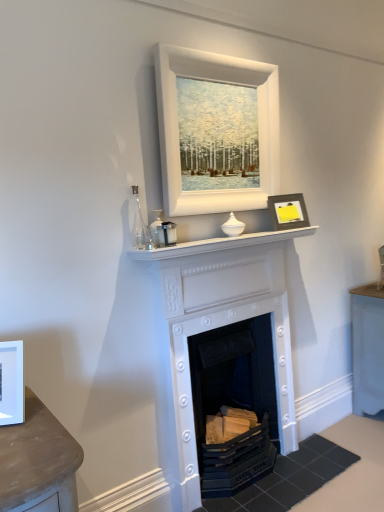
The height and width of the screenshot is (512, 384). What are the coordinates of `matte black frame at upper right, which ranks as the 3th picture frame in left-to-right order` in the screenshot? It's located at (288, 211).

Measure the distance between matte black frame at upper right, placed as the 1th picture frame when sorted from right to left, and camera.

matte black frame at upper right, placed as the 1th picture frame when sorted from right to left, is 7.21 feet away from camera.

Where is `white glossy mantle at center`? white glossy mantle at center is located at coordinates (215, 245).

What is the approximate height of white matte picture frame at left, which ranks as the 1th picture frame in left-to-right order?

It is 9.43 inches.

This screenshot has height=512, width=384. Describe the element at coordinates (235, 403) in the screenshot. I see `white painted wood fireplace at center, arranged as the 2th fireplace when viewed from the top` at that location.

Identify the location of white painted wood fireplace at center, placed as the 1th fireplace when sorted from bottom to top. (235, 403).

Locate an element on the screen. matte black frame at upper right, the 2th picture frame positioned from the top is located at coordinates (288, 211).

This screenshot has width=384, height=512. In the image, there is a matte black frame at upper right, which is the 3th picture frame in front-to-back order. Identify the location of picture frame above it (from the image's perspective). (178, 130).

Based on the photo, between white matte picture frame at upper center, marked as the 3th picture frame in a bottom-to-top arrangement, and matte black frame at upper right, which ranks as the 3th picture frame in left-to-right order, which one has smaller width?

matte black frame at upper right, which ranks as the 3th picture frame in left-to-right order.

In the scene shown: Is white matte picture frame at upper center, which appears as the 2th picture frame when viewed from the right, positioned before matte black frame at upper right, placed as the 1th picture frame when sorted from right to left?

Yes, it is.

Is white matte picture frame at upper center, which appears as the 2th picture frame when viewed from the right, completely or partially outside of matte black frame at upper right, the 2th picture frame positioned from the top?

Absolutely, white matte picture frame at upper center, which appears as the 2th picture frame when viewed from the right, is external to matte black frame at upper right, the 2th picture frame positioned from the top.

Does matte black frame at upper right, arranged as the second picture frame when ordered from the bottom, turn towards white painted wood fireplace at center, arranged as the 2th fireplace when viewed from the top?

No, matte black frame at upper right, arranged as the second picture frame when ordered from the bottom, does not turn towards white painted wood fireplace at center, arranged as the 2th fireplace when viewed from the top.

From the image's perspective, between matte black frame at upper right, placed as the 1th picture frame when sorted from right to left, and white painted wood fireplace at center, arranged as the 2th fireplace when viewed from the top, who is located below?

white painted wood fireplace at center, arranged as the 2th fireplace when viewed from the top, from the image's perspective.

Is matte black frame at upper right, the first picture frame positioned from the back, bigger or smaller than white painted wood fireplace at center, placed as the 1th fireplace when sorted from bottom to top?

matte black frame at upper right, the first picture frame positioned from the back, is smaller than white painted wood fireplace at center, placed as the 1th fireplace when sorted from bottom to top.

Does matte black frame at upper right, which is the 3th picture frame in front-to-back order, come behind white painted wood fireplace at center, arranged as the 2th fireplace when viewed from the top?

Yes, the depth of matte black frame at upper right, which is the 3th picture frame in front-to-back order, is greater than that of white painted wood fireplace at center, arranged as the 2th fireplace when viewed from the top.

Locate an element on the screen. This screenshot has width=384, height=512. fireplace that is the 2nd object located in front of the matte black frame at upper right, which ranks as the 3th picture frame in left-to-right order is located at coordinates (221, 325).

Is point (184, 472) in front of point (287, 220)?

Yes, point (184, 472) is in front of point (287, 220).

Is white painted fireplace at center, which is the first fireplace in top-to-bottom order, looking in the opposite direction of matte black frame at upper right, placed as the 1th picture frame when sorted from right to left?

white painted fireplace at center, which is the first fireplace in top-to-bottom order, does not have its back to matte black frame at upper right, placed as the 1th picture frame when sorted from right to left.

Between white glossy mantle at center and matte black frame at upper right, arranged as the second picture frame when ordered from the bottom, which one has more height?

matte black frame at upper right, arranged as the second picture frame when ordered from the bottom.

In terms of size, does white glossy mantle at center appear bigger or smaller than matte black frame at upper right, the 2th picture frame positioned from the top?

Considering their sizes, white glossy mantle at center takes up more space than matte black frame at upper right, the 2th picture frame positioned from the top.

Considering the positions of points (205, 240) and (292, 199), is point (205, 240) closer to camera compared to point (292, 199)?

Yes, point (205, 240) is in front of point (292, 199).

From a real-world perspective, does white glossy mantle at center sit lower than matte black frame at upper right, the 2th picture frame positioned from the top?

Yes, from a real-world perspective, white glossy mantle at center is under matte black frame at upper right, the 2th picture frame positioned from the top.

Is white matte picture frame at upper center, the 2th picture frame viewed from the back, far away from white painted wood fireplace at center, arranged as the 2th fireplace when viewed from the top?

white matte picture frame at upper center, the 2th picture frame viewed from the back, is far away from white painted wood fireplace at center, arranged as the 2th fireplace when viewed from the top.

From the picture: Considering the relative sizes of white matte picture frame at upper center, the 2th picture frame viewed from the back, and white painted wood fireplace at center, placed as the 1th fireplace when sorted from bottom to top, in the image provided, is white matte picture frame at upper center, the 2th picture frame viewed from the back, taller than white painted wood fireplace at center, placed as the 1th fireplace when sorted from bottom to top,?

No, white matte picture frame at upper center, the 2th picture frame viewed from the back, is not taller than white painted wood fireplace at center, placed as the 1th fireplace when sorted from bottom to top.

Does white matte picture frame at upper center, the 2th picture frame viewed from the back, turn towards white painted wood fireplace at center, arranged as the 2th fireplace when viewed from the top?

No.

Measure the distance from white painted fireplace at center, which is the first fireplace in top-to-bottom order, to white glossy mantle at center.

white painted fireplace at center, which is the first fireplace in top-to-bottom order, and white glossy mantle at center are 11.15 inches apart.

Are white painted fireplace at center, placed as the 2th fireplace when sorted from bottom to top, and white glossy mantle at center far apart?

That's not correct — white painted fireplace at center, placed as the 2th fireplace when sorted from bottom to top, is a little close to white glossy mantle at center.

Is point (201, 315) positioned behind point (156, 259)?

Yes, point (201, 315) is behind point (156, 259).

In the scene shown: Looking at their sizes, would you say white painted fireplace at center, which is the first fireplace in top-to-bottom order, is wider or thinner than white glossy mantle at center?

Considering their sizes, white painted fireplace at center, which is the first fireplace in top-to-bottom order, looks broader than white glossy mantle at center.

In terms of size, does white glossy mantle at center appear bigger or smaller than white matte picture frame at upper center, the 2th picture frame viewed from the back?

In the image, white glossy mantle at center appears to be smaller than white matte picture frame at upper center, the 2th picture frame viewed from the back.

Is white glossy mantle at center at the right side of white matte picture frame at upper center, marked as the 3th picture frame in a bottom-to-top arrangement?

Indeed, white glossy mantle at center is positioned on the right side of white matte picture frame at upper center, marked as the 3th picture frame in a bottom-to-top arrangement.

Which of these two, white glossy mantle at center or white matte picture frame at upper center, marked as the 3th picture frame in a bottom-to-top arrangement, is thinner?

white matte picture frame at upper center, marked as the 3th picture frame in a bottom-to-top arrangement, is thinner.

Which picture frame is the 1st one when counting from the front of the matte black frame at upper right, which ranks as the 3th picture frame in left-to-right order? Please provide its 2D coordinates.

[(178, 130)]

From the image's perspective, which picture frame is the 2nd one above the white painted wood fireplace at center, placed as the 1th fireplace when sorted from bottom to top? Please provide its 2D coordinates.

[(288, 211)]

Considering their positions, is white glossy mantle at center positioned further to white matte picture frame at upper center, marked as the 3th picture frame in a bottom-to-top arrangement, than matte black frame at upper right, arranged as the second picture frame when ordered from the bottom?

Among the two, white glossy mantle at center is located further to white matte picture frame at upper center, marked as the 3th picture frame in a bottom-to-top arrangement.

Considering their positions, is matte black frame at upper right, arranged as the second picture frame when ordered from the bottom, positioned closer to white painted wood fireplace at center, arranged as the 2th fireplace when viewed from the top, than white matte picture frame at left, which ranks as the 1th picture frame in left-to-right order?

matte black frame at upper right, arranged as the second picture frame when ordered from the bottom, lies closer to white painted wood fireplace at center, arranged as the 2th fireplace when viewed from the top, than the other object.

From the picture: When comparing their distances from white matte picture frame at left, which is the third picture frame in top-to-bottom order, does matte black frame at upper right, which is the 3th picture frame in front-to-back order, or white glossy mantle at center seem closer?

white glossy mantle at center is positioned closer to the anchor white matte picture frame at left, which is the third picture frame in top-to-bottom order.

Estimate the real-world distances between objects in this image. Which object is further from white matte picture frame at left, the third picture frame positioned from the back, white painted fireplace at center, placed as the 2th fireplace when sorted from bottom to top, or matte black frame at upper right, arranged as the second picture frame when ordered from the bottom?

Among the two, matte black frame at upper right, arranged as the second picture frame when ordered from the bottom, is located further to white matte picture frame at left, the third picture frame positioned from the back.

Based on their spatial positions, is white painted fireplace at center, placed as the 2th fireplace when sorted from bottom to top, or white matte picture frame at left, placed as the first picture frame when sorted from front to back, further from white matte picture frame at upper center, which is the 1th picture frame in top-to-bottom order?

white matte picture frame at left, placed as the first picture frame when sorted from front to back, lies further to white matte picture frame at upper center, which is the 1th picture frame in top-to-bottom order, than the other object.

Looking at this image, estimate the real-world distances between objects in this image. Which object is closer to white painted wood fireplace at center, placed as the 1th fireplace when sorted from bottom to top, white matte picture frame at upper center, marked as the second picture frame in a left-to-right arrangement, or white painted fireplace at center, which is the first fireplace in top-to-bottom order?

white painted fireplace at center, which is the first fireplace in top-to-bottom order, is closer to white painted wood fireplace at center, placed as the 1th fireplace when sorted from bottom to top.

From the image, which object appears to be nearer to white matte picture frame at upper center, which appears as the 2th picture frame when viewed from the right, white painted wood fireplace at center, placed as the 1th fireplace when sorted from bottom to top, or matte black frame at upper right, the first picture frame positioned from the back?

matte black frame at upper right, the first picture frame positioned from the back, lies closer to white matte picture frame at upper center, which appears as the 2th picture frame when viewed from the right, than the other object.

Considering their positions, is white painted wood fireplace at center, placed as the 1th fireplace when sorted from bottom to top, positioned closer to white glossy mantle at center than white painted fireplace at center, which is the first fireplace in top-to-bottom order?

white painted fireplace at center, which is the first fireplace in top-to-bottom order.

Locate an element on the screen. mantle between white matte picture frame at upper center, which is the 1th picture frame in top-to-bottom order, and white painted wood fireplace at center, arranged as the 2th fireplace when viewed from the top, in the vertical direction is located at coordinates (215, 245).

Find the location of `fireplace between matte black frame at upper right, arranged as the second picture frame when ordered from the bottom, and white painted wood fireplace at center, placed as the 1th fireplace when sorted from bottom to top, from top to bottom`. fireplace between matte black frame at upper right, arranged as the second picture frame when ordered from the bottom, and white painted wood fireplace at center, placed as the 1th fireplace when sorted from bottom to top, from top to bottom is located at coordinates (221, 325).

This screenshot has width=384, height=512. I want to click on mantle between matte black frame at upper right, arranged as the second picture frame when ordered from the bottom, and white painted wood fireplace at center, arranged as the 2th fireplace when viewed from the top, from top to bottom, so click(215, 245).

Image resolution: width=384 pixels, height=512 pixels. I want to click on mantle between white matte picture frame at left, which ranks as the 1th picture frame in left-to-right order, and matte black frame at upper right, which is the 3th picture frame in front-to-back order, in the horizontal direction, so click(215, 245).